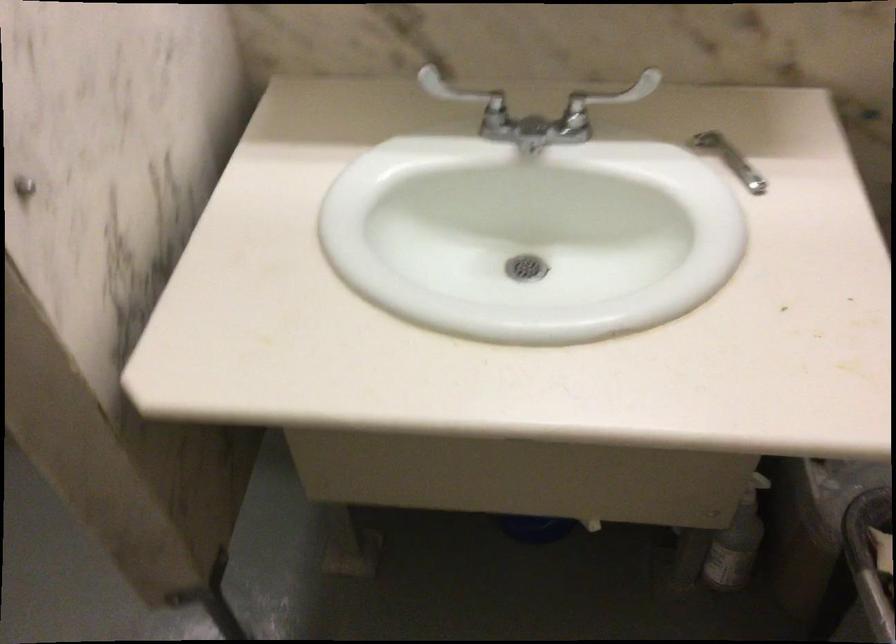
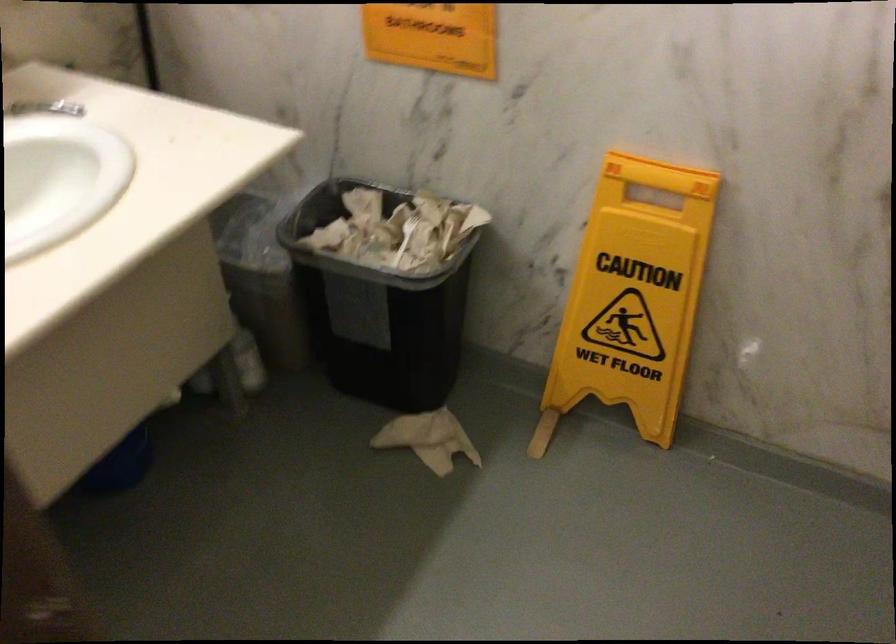
Question: The camera is either moving clockwise (left) or counter-clockwise (right) around the object. The first image is from the beginning of the video and the second image is from the end. Is the camera moving left or right when shooting the video?

Choices:
 (A) Left
 (B) Right

Answer: (A)